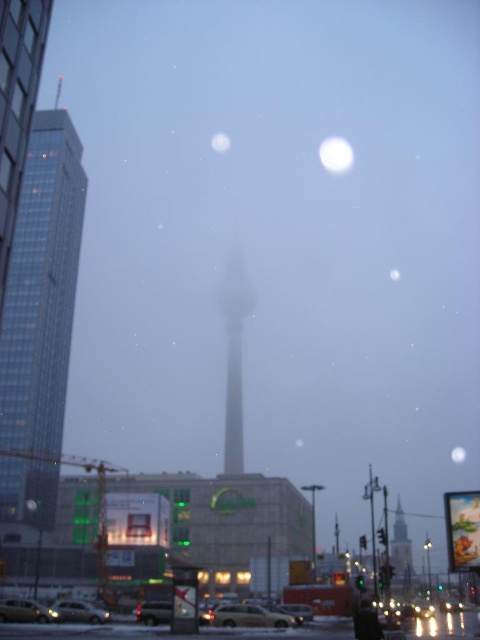
What is located at the point with coordinates [233,356] in the image?

The point at coordinates [233,356] is occupied by the smooth gray tower at center.

You are a city planner assessing the urban layout. Given the glassy skyscraper at left and the matte black car at lower left, which object is taller?

The glassy skyscraper at left is taller than the matte black car at lower left according to the description.

You are a city planner analyzing the urban scene. You need to determine if the silver metallic car at center can be seen from the top of the white glossy moon at upper center. Based on their heights, is this possible?

The silver metallic car at center has a lesser height compared to the white glossy moon at upper center. Since the car is shorter, it might be obscured by the moon if they are in the same line of sight. However, the moon is in the sky, so the car cannot be seen from the moon as they are in different planes.